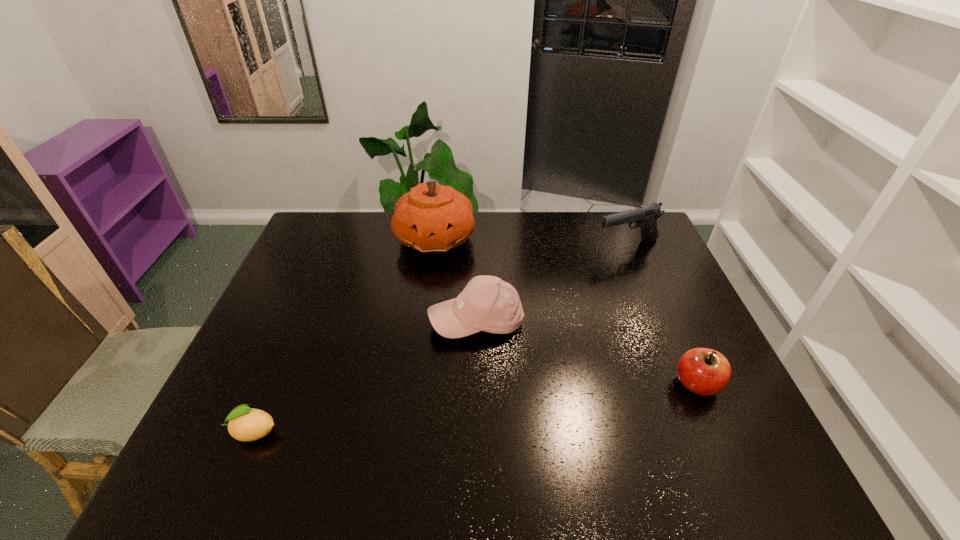
This screenshot has width=960, height=540. I want to click on vacant space at the left edge of the desktop, so click(x=288, y=289).

This screenshot has height=540, width=960. I want to click on vacant space at the right edge of the desktop, so click(x=697, y=332).

I want to click on free space at the far left corner of the desktop, so click(x=332, y=241).

The width and height of the screenshot is (960, 540). What are the coordinates of `free space at the near left corner` in the screenshot? It's located at (224, 410).

Identify the location of free space between the baseball cap and the gun. (552, 284).

At what (x,y) coordinates should I click in order to perform the action: click on vacant area that lies between the third farthest object and the gun. Please return your answer as a coordinate pair (x, y). The image size is (960, 540). Looking at the image, I should click on (552, 284).

In order to click on vacant space that's between the baseball cap and the gun in this screenshot , I will do `click(552, 284)`.

At what (x,y) coordinates should I click in order to perform the action: click on free space between the pumpkin and the gun. Please return your answer as a coordinate pair (x, y). The height and width of the screenshot is (540, 960). Looking at the image, I should click on (532, 242).

This screenshot has width=960, height=540. In order to click on vacant area that lies between the lemon and the baseball cap in this screenshot , I will do `click(365, 375)`.

This screenshot has width=960, height=540. I want to click on vacant space in between the apple and the pumpkin, so click(566, 311).